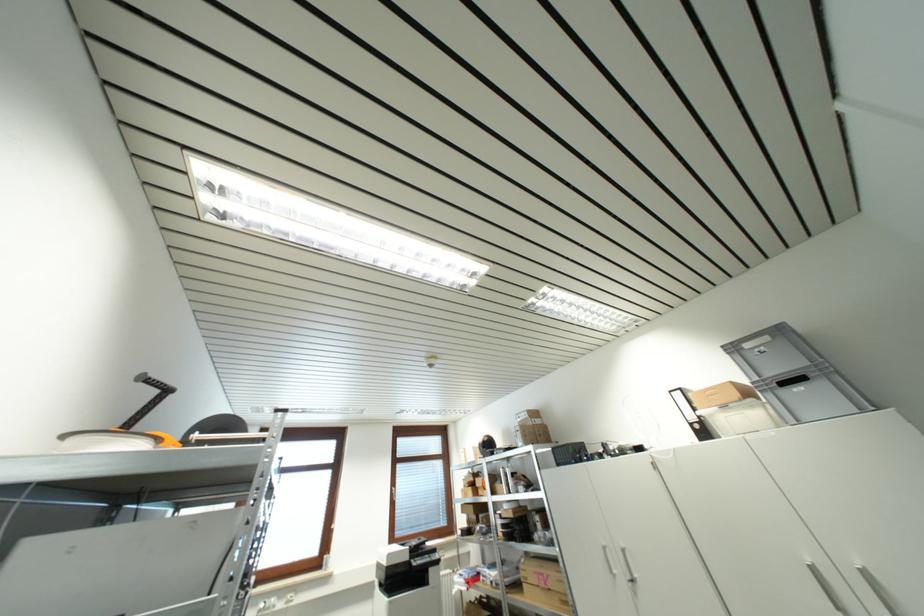
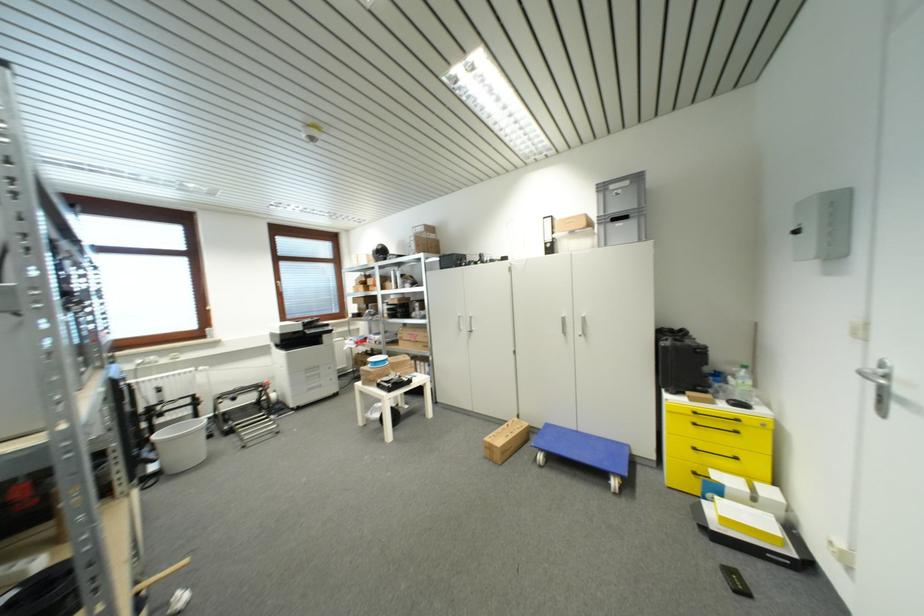
Question: I am providing you with two images of the same scene from different viewpoints. After the viewpoint changes to image2, which objects are now occluded?

Choices:
 (A) black remote control
 (B) grey plastic bin
 (C) black carrying case
 (D) none of these

Answer: (D)